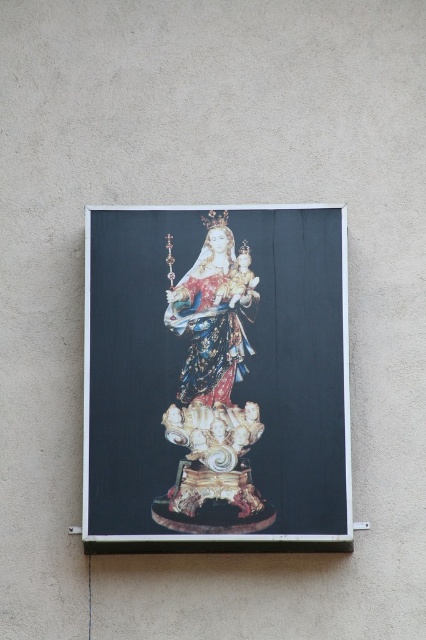
Does gold-gilded statue at center appear on the left side of shiny gold statue at center?

Indeed, gold-gilded statue at center is positioned on the left side of shiny gold statue at center.

Is the position of gold-gilded statue at center more distant than that of shiny gold statue at center?

No, it is not.

The image size is (426, 640). Find the location of `gold-gilded statue at center`. gold-gilded statue at center is located at coordinates (215, 378).

The height and width of the screenshot is (640, 426). In order to click on gold-gilded statue at center in this screenshot , I will do `click(215, 378)`.